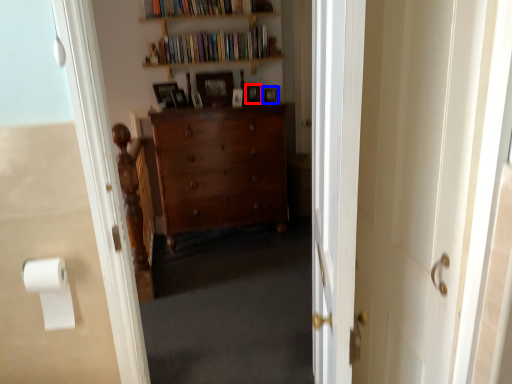
Question: Which point is further to the camera, picture frame (highlighted by a red box) or picture frame (highlighted by a blue box)?

Choices:
 (A) picture frame
 (B) picture frame

Answer: (A)